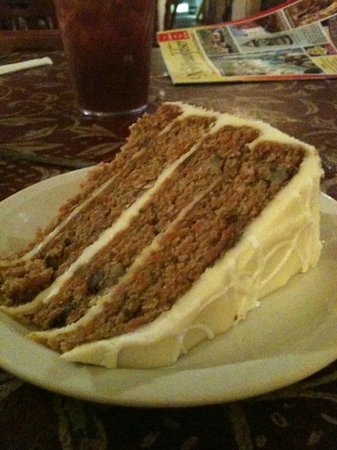
The width and height of the screenshot is (337, 450). In order to click on place mat in this screenshot , I will do `click(250, 431)`.